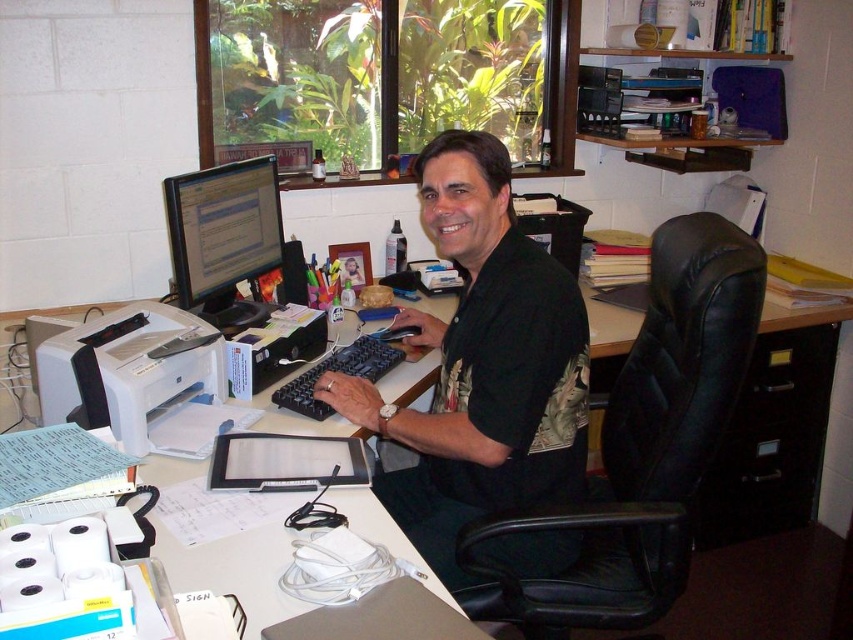
Question: Can you confirm if black matte shirt at center is smaller than black plastic monitor at upper center?

Choices:
 (A) yes
 (B) no

Answer: (B)

Question: Which point is farther from the camera taking this photo?

Choices:
 (A) (421, 513)
 (B) (196, 276)

Answer: (B)

Question: Based on their relative distances, which object is farther from the matte black monitor at upper left?

Choices:
 (A) white matte printer at left
 (B) black plastic monitor at upper center

Answer: (B)

Question: Does black plastic monitor at upper center have a smaller size compared to white matte printer at left?

Choices:
 (A) yes
 (B) no

Answer: (B)

Question: Which point is closer to the camera?

Choices:
 (A) (33, 348)
 (B) (230, 276)
 (C) (619, 337)
 (D) (518, 342)

Answer: (D)

Question: Does white matte printer at left have a smaller size compared to matte black monitor at upper left?

Choices:
 (A) yes
 (B) no

Answer: (B)